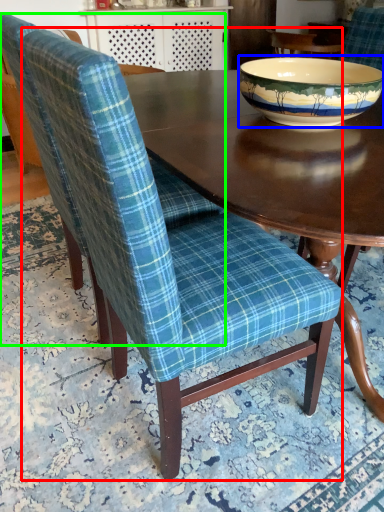
Question: Which object is positioned closest to chair (highlighted by a red box)? Select from bowl (highlighted by a blue box) and chair (highlighted by a green box).

Choices:
 (A) bowl
 (B) chair

Answer: (B)